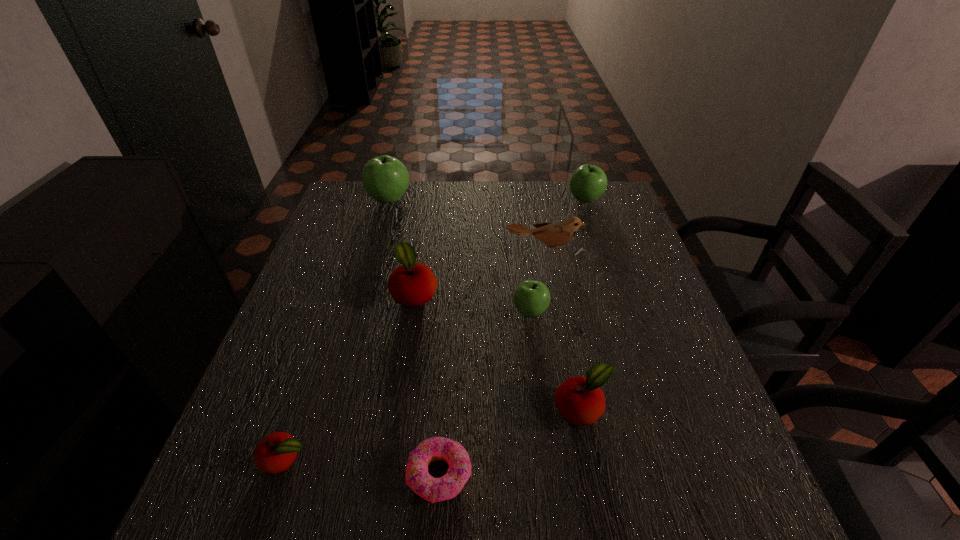
Find the location of a particular element. The image size is (960, 540). vacant region located on the right of the third nearest object is located at coordinates click(x=672, y=409).

The image size is (960, 540). Identify the location of vacant region located on the right of the leftmost red apple. (498, 459).

Find the location of a particular element. free region located on the back of the shortest object is located at coordinates (444, 415).

Identify the location of object at the near edge. (432, 489).

Identify the location of apple at the right edge. (588, 183).

What are the coordinates of `bird present at the right edge` in the screenshot? It's located at (554, 235).

The width and height of the screenshot is (960, 540). What are the coordinates of `object located in the far left corner section of the desktop` in the screenshot? It's located at (385, 178).

Locate an element on the screen. This screenshot has height=540, width=960. object positioned at the far right corner is located at coordinates (588, 183).

Where is `vacant space at the far edge`? This screenshot has height=540, width=960. vacant space at the far edge is located at coordinates (424, 198).

In the image, there is a desktop. Identify the location of vacant area at the near edge. (444, 528).